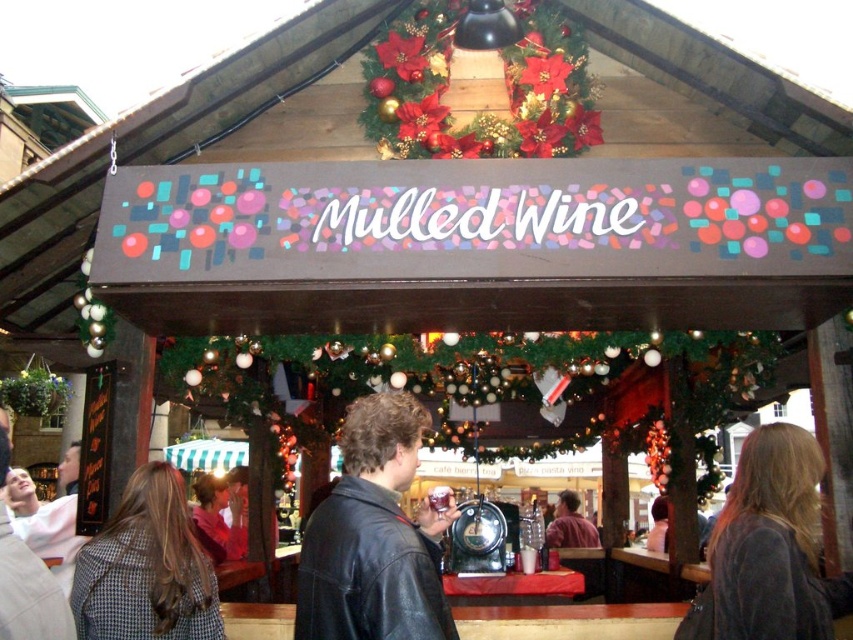
You are a vendor at the market stall and need to place a new sign between the leather jacket at center and the red velvet wreath at upper center. Since the sign must be wider than both items, which item should you place the sign next to to ensure it fits?

The red velvet wreath at upper center is wider than the leather jacket at center, so placing the sign next to the red velvet wreath at upper center will ensure it is wider than both items.